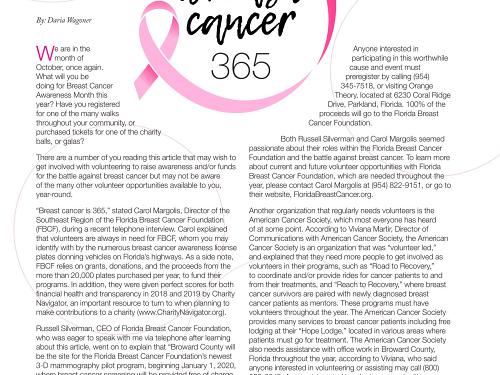
This screenshot has width=500, height=375. I want to click on space between columns, so click(x=239, y=235).